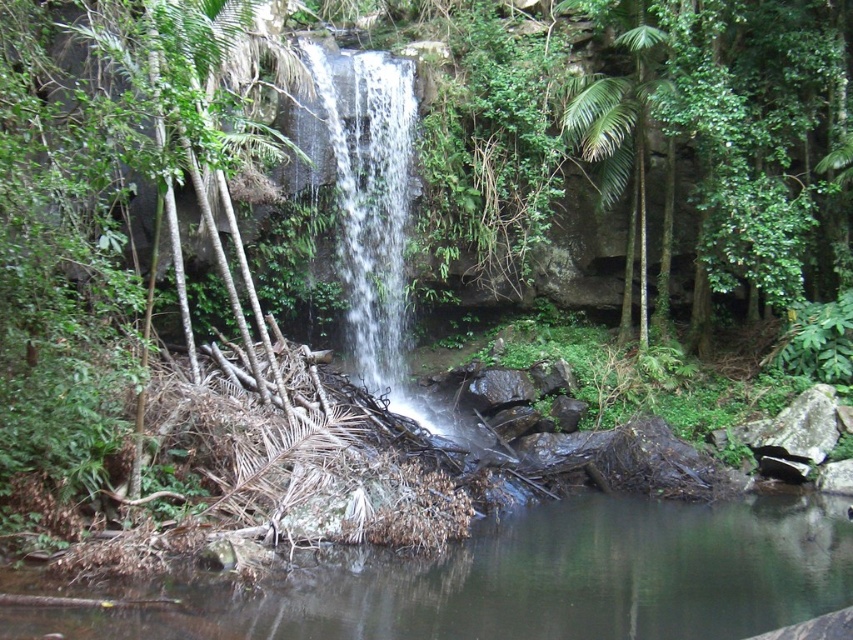
Question: Is green mossy log at lower center above clear water at center?

Choices:
 (A) no
 (B) yes

Answer: (A)

Question: Does green mossy log at lower center have a smaller size compared to clear water at center?

Choices:
 (A) no
 (B) yes

Answer: (A)

Question: Is green mossy log at lower center wider than clear water at center?

Choices:
 (A) yes
 (B) no

Answer: (A)

Question: Which object is closer to the camera taking this photo?

Choices:
 (A) clear water at center
 (B) green mossy log at lower center

Answer: (B)

Question: Which of the following is the farthest from the observer?

Choices:
 (A) (375, 74)
 (B) (805, 536)

Answer: (A)